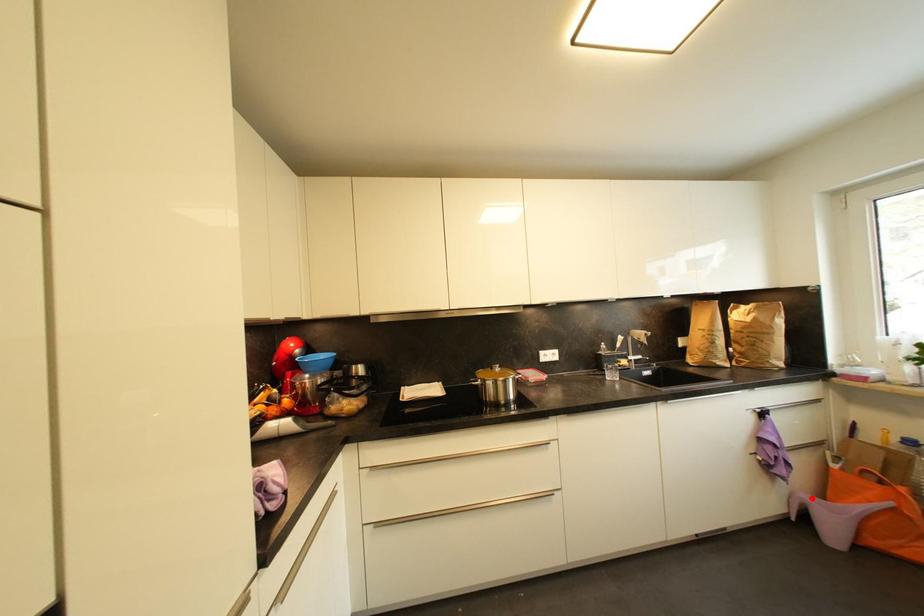
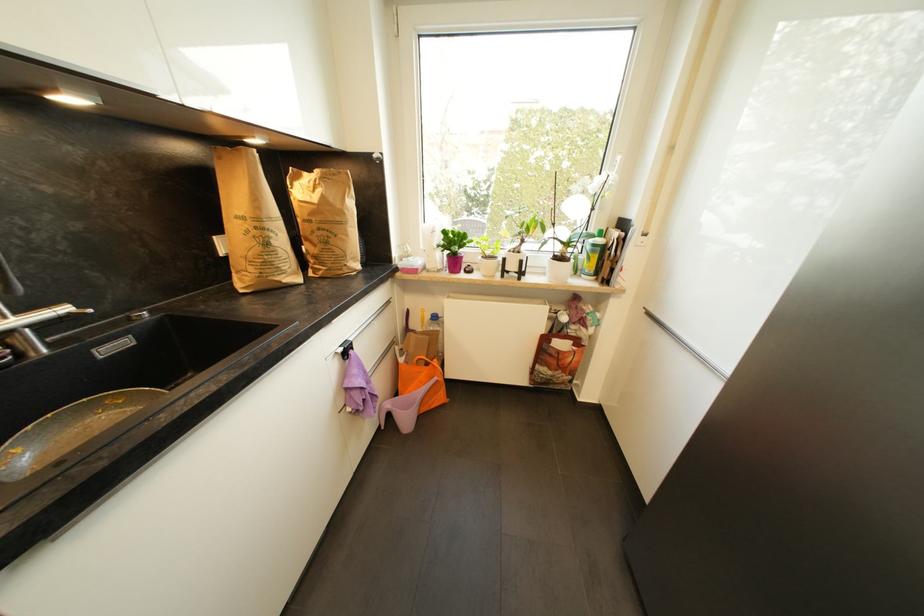
Question: I am providing you with two images of the same scene from different viewpoints. Image1 has a red point marked. In image2, the corresponding 3D location appears at what relative position? Reply with the corresponding letter.

Choices:
 (A) Closer
 (B) Farther

Answer: (B)